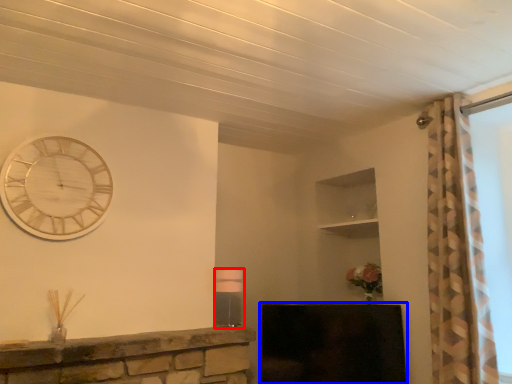
Question: Among these objects, which one is farthest to the camera, lamp (highlighted by a red box) or fireplace (highlighted by a blue box)?

Choices:
 (A) lamp
 (B) fireplace

Answer: (B)